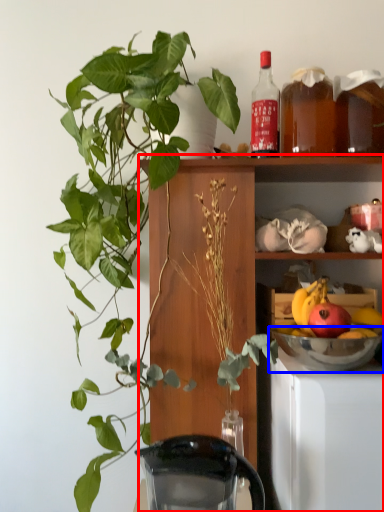
Question: Among these objects, which one is nearest to the camera, cabinetry (highlighted by a red box) or mixing bowl (highlighted by a blue box)?

Choices:
 (A) cabinetry
 (B) mixing bowl

Answer: (A)